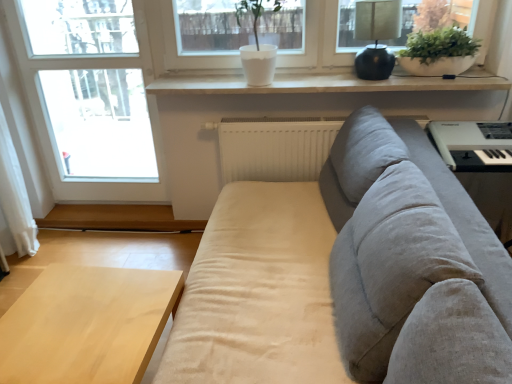
Question: Considering the positions of matte black lamp at upper right and white matte bowl at upper right in the image, is matte black lamp at upper right wider or thinner than white matte bowl at upper right?

Choices:
 (A) thin
 (B) wide

Answer: (B)

Question: Is matte black lamp at upper right taller or shorter than white matte bowl at upper right?

Choices:
 (A) tall
 (B) short

Answer: (A)

Question: Considering the real-world distances, which object is closest to the transparent glass window at left?

Choices:
 (A) beige fabric couch at center
 (B) white matte bowl at upper right
 (C) light wood table at lower left
 (D) matte black lamp at upper right
 (E) white matte radiator at center

Answer: (E)

Question: Estimate the real-world distances between objects in this image. Which object is closer to the white matte bowl at upper right?

Choices:
 (A) transparent glass window at left
 (B) beige fabric couch at center
 (C) light wood table at lower left
 (D) white matte window sill at upper center
 (E) white matte radiator at center

Answer: (D)